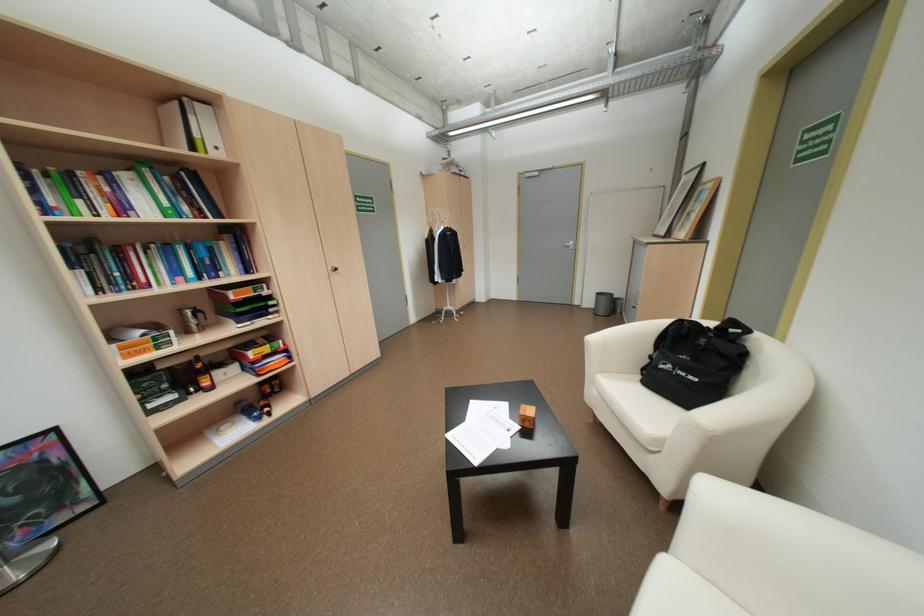
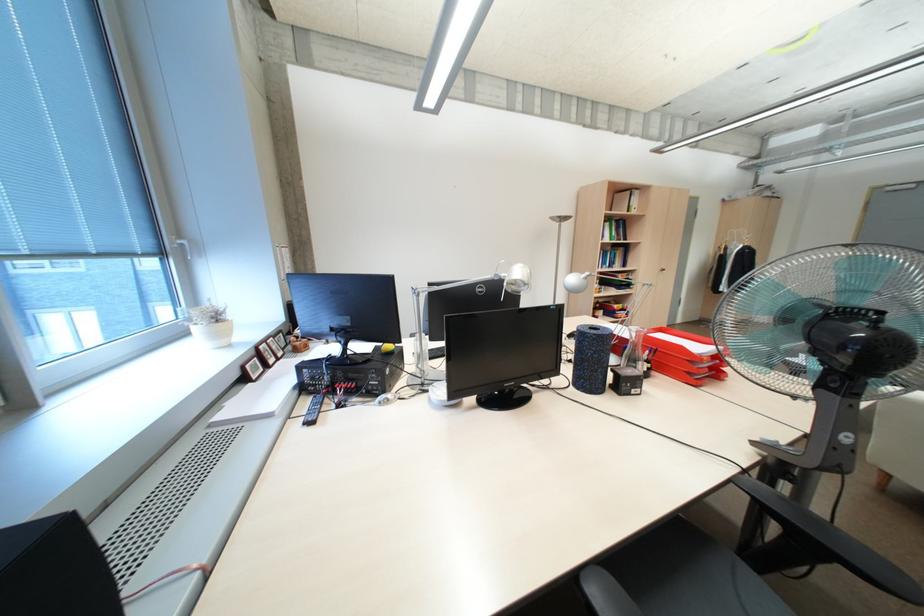
The point at (186, 270) is marked in the first image. Where is the corresponding point in the second image?

(614, 262)